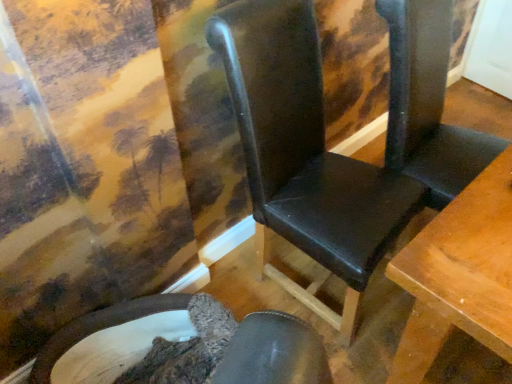
Question: From a real-world perspective, is black leather chair at center, positioned as the first chair in right-to-left order, on top of black leather folding chair at center?

Choices:
 (A) no
 (B) yes

Answer: (A)

Question: Does black leather chair at center, which is the second chair from left to right, have a smaller size compared to black leather folding chair at center?

Choices:
 (A) yes
 (B) no

Answer: (B)

Question: From a real-world perspective, does black leather chair at center, positioned as the first chair in right-to-left order, sit lower than black leather folding chair at center?

Choices:
 (A) no
 (B) yes

Answer: (B)

Question: Does black leather chair at center, positioned as the first chair in right-to-left order, appear on the left side of black leather folding chair at center?

Choices:
 (A) no
 (B) yes

Answer: (B)

Question: Is black leather chair at center, positioned as the first chair in right-to-left order, surrounding black leather folding chair at center?

Choices:
 (A) yes
 (B) no

Answer: (B)

Question: Is black leather folding chair at center at the back of black leather chair at center, positioned as the first chair in right-to-left order?

Choices:
 (A) yes
 (B) no

Answer: (B)

Question: Is black leather folding chair at center in front of black leather chair at center, positioned as the first chair in right-to-left order?

Choices:
 (A) no
 (B) yes

Answer: (A)

Question: Is black leather folding chair at center wider than black leather chair at center, which is the second chair from left to right?

Choices:
 (A) no
 (B) yes

Answer: (A)

Question: From a real-world perspective, is black leather folding chair at center located higher than black leather chair at center, which is the second chair from left to right?

Choices:
 (A) yes
 (B) no

Answer: (A)

Question: From the image's perspective, is black leather folding chair at center over black leather chair at center, positioned as the first chair in right-to-left order?

Choices:
 (A) yes
 (B) no

Answer: (A)

Question: Is black leather folding chair at center facing towards black leather chair at center, positioned as the first chair in right-to-left order?

Choices:
 (A) yes
 (B) no

Answer: (B)

Question: Is black leather folding chair at center further to the viewer compared to black leather chair at center, which is the second chair from left to right?

Choices:
 (A) no
 (B) yes

Answer: (B)

Question: From the image's perspective, is black leather folding chair at center under velvet-like brown chair at lower left, the first chair when ordered from left to right?

Choices:
 (A) no
 (B) yes

Answer: (A)